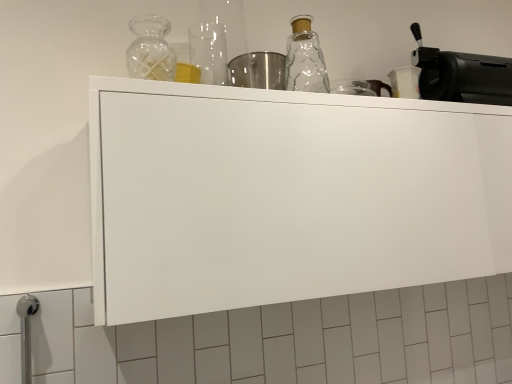
Question: Can we say white matte cabinet at upper center lies outside clear glass bottle at upper center?

Choices:
 (A) yes
 (B) no

Answer: (A)

Question: Does white matte cabinet at upper center have a larger size compared to clear glass bottle at upper center?

Choices:
 (A) no
 (B) yes

Answer: (B)

Question: Considering the relative positions of white matte cabinet at upper center and clear glass bottle at upper center in the image provided, is white matte cabinet at upper center to the left of clear glass bottle at upper center from the viewer's perspective?

Choices:
 (A) yes
 (B) no

Answer: (B)

Question: Considering the relative positions of white matte cabinet at upper center and clear glass bottle at upper center in the image provided, is white matte cabinet at upper center behind clear glass bottle at upper center?

Choices:
 (A) no
 (B) yes

Answer: (A)

Question: From a real-world perspective, is white matte cabinet at upper center physically above clear glass bottle at upper center?

Choices:
 (A) no
 (B) yes

Answer: (A)

Question: In terms of width, does white matte cabinet at upper center look wider or thinner when compared to black matte coffee machine at upper right?

Choices:
 (A) thin
 (B) wide

Answer: (B)

Question: Would you say white matte cabinet at upper center is to the left or to the right of black matte coffee machine at upper right in the picture?

Choices:
 (A) right
 (B) left

Answer: (B)

Question: Considering the positions of point (278, 216) and point (503, 61), is point (278, 216) closer or farther from the camera than point (503, 61)?

Choices:
 (A) closer
 (B) farther

Answer: (A)

Question: Is white matte cabinet at upper center taller or shorter than black matte coffee machine at upper right?

Choices:
 (A) short
 (B) tall

Answer: (B)

Question: Is point (165, 46) positioned closer to the camera than point (506, 74)?

Choices:
 (A) closer
 (B) farther

Answer: (A)

Question: From the image's perspective, relative to black matte coffee machine at upper right, is clear glass bottle at upper center above or below?

Choices:
 (A) above
 (B) below

Answer: (B)

Question: Looking at the image, does clear glass bottle at upper center seem bigger or smaller compared to black matte coffee machine at upper right?

Choices:
 (A) small
 (B) big

Answer: (A)

Question: In terms of width, does clear glass bottle at upper center look wider or thinner when compared to black matte coffee machine at upper right?

Choices:
 (A) wide
 (B) thin

Answer: (A)

Question: In the image, is black matte coffee machine at upper right on the left side or the right side of white matte cabinet at upper center?

Choices:
 (A) right
 (B) left

Answer: (A)

Question: From the image's perspective, relative to white matte cabinet at upper center, is black matte coffee machine at upper right above or below?

Choices:
 (A) above
 (B) below

Answer: (A)